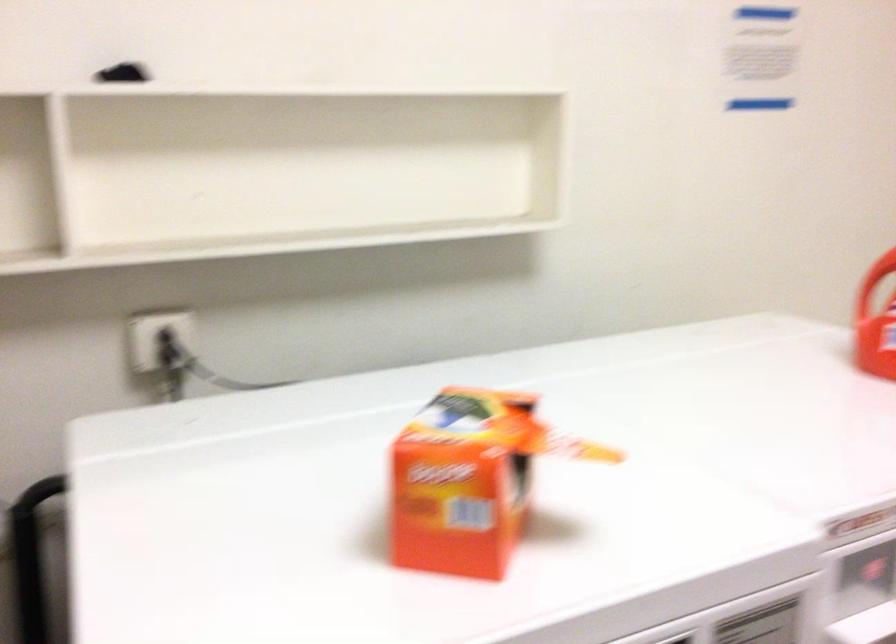
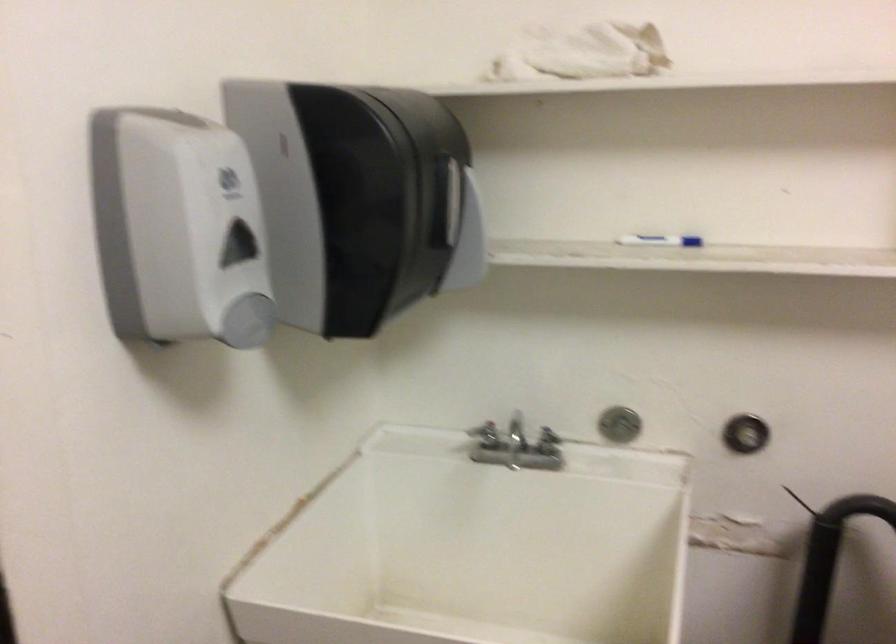
Question: Based on the continuous images, in which direction is the camera rotating? Reply with the corresponding letter.

Choices:
 (A) Left
 (B) Right
 (C) Up
 (D) Down

Answer: (A)